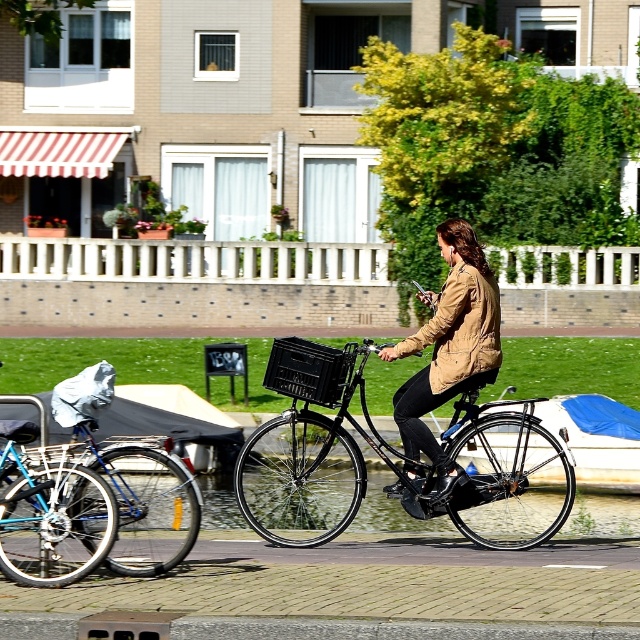
Who is positioned more to the left, camouflage jacket at center or blue tarpaulin boat at center?

camouflage jacket at center

Who is more forward, (483, 358) or (593, 417)?

Point (483, 358) is in front.

Locate an element on the screen. The width and height of the screenshot is (640, 640). camouflage jacket at center is located at coordinates (449, 348).

Does black matte bicycle at center have a lesser height compared to camouflage jacket at center?

Yes.

Is black matte bicycle at center wider than camouflage jacket at center?

Indeed, black matte bicycle at center has a greater width compared to camouflage jacket at center.

The width and height of the screenshot is (640, 640). Identify the location of black matte bicycle at center. (x=390, y=460).

Is blue metallic bicycle at center bigger than camouflage jacket at center?

No, blue metallic bicycle at center is not bigger than camouflage jacket at center.

Between point (19, 557) and point (420, 428), which one is positioned in front?

Positioned in front is point (19, 557).

What do you see at coordinates (92, 508) in the screenshot? This screenshot has width=640, height=640. I see `blue metallic bicycle at center` at bounding box center [92, 508].

This screenshot has width=640, height=640. In order to click on blue metallic bicycle at center in this screenshot , I will do `click(92, 508)`.